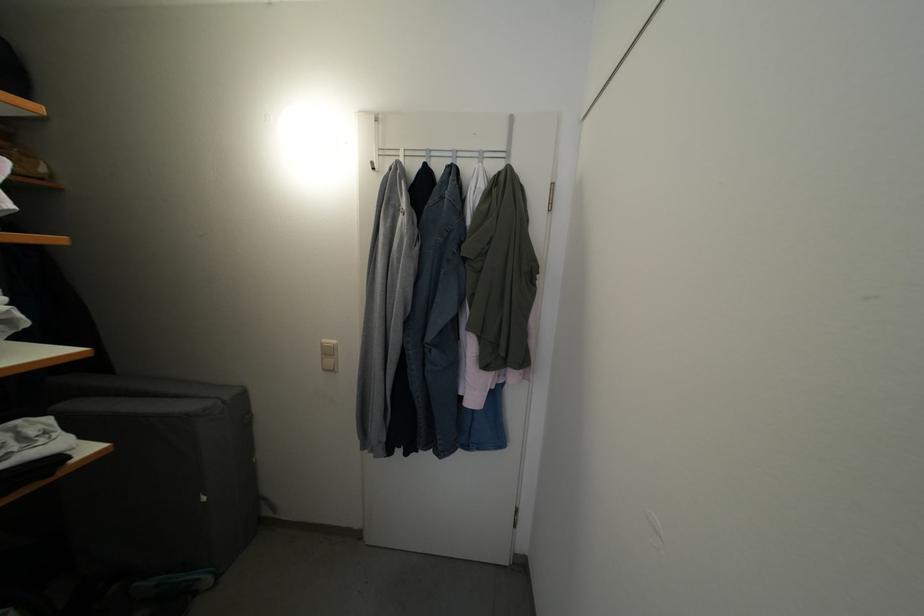
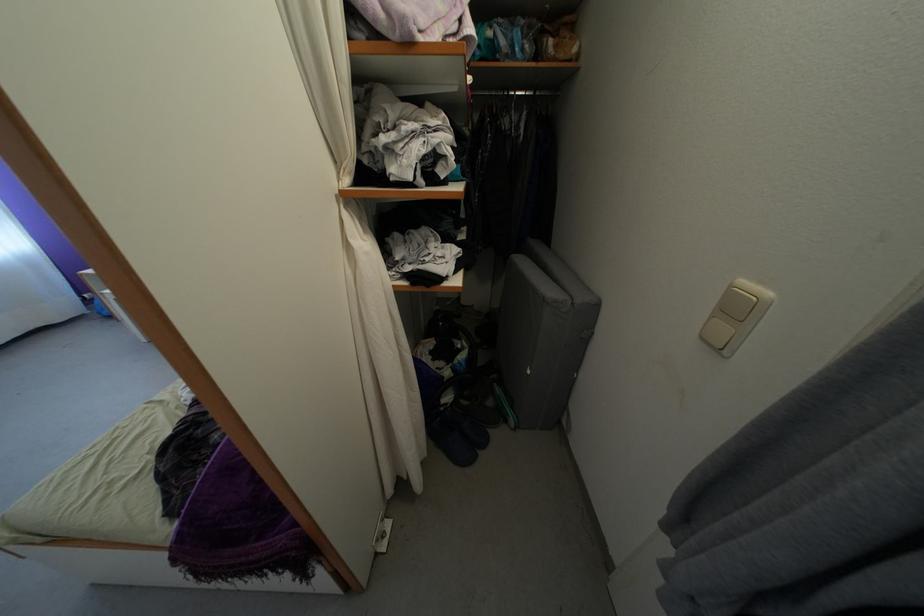
Find the pixel in the second image that matches (210,505) in the first image.

(535, 378)